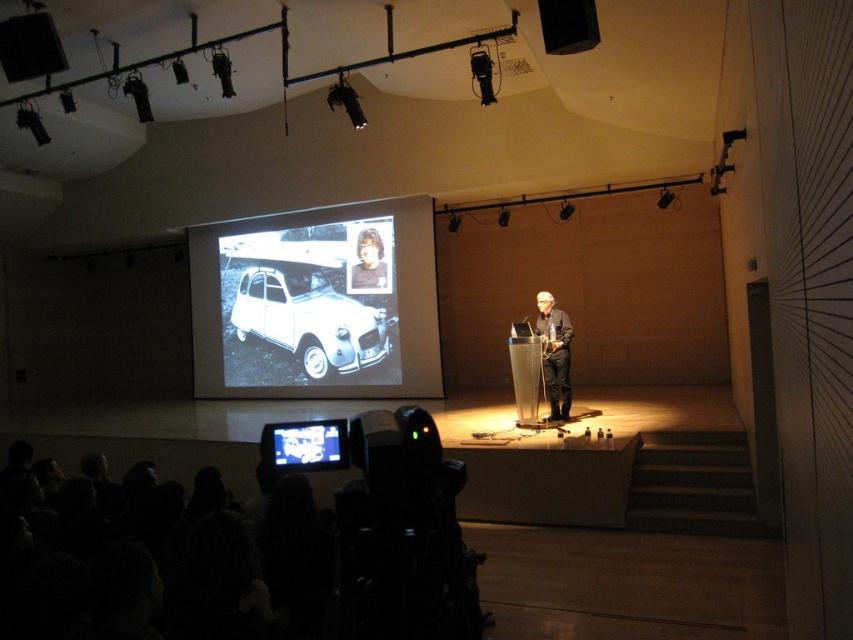
Which is in front, point (392, 259) or point (350, 280)?

Positioned in front is point (392, 259).

Is black matte projection screen at center thinner than smooth skin face at center?

No, black matte projection screen at center is not thinner than smooth skin face at center.

Locate an element on the screen. The image size is (853, 640). black matte projection screen at center is located at coordinates coord(315,305).

Is white matte car at center to the right of black fabric person at center from the viewer's perspective?

No, white matte car at center is not to the right of black fabric person at center.

Is white matte car at center further to the viewer compared to black fabric person at center?

Yes, it is behind black fabric person at center.

Which is in front, point (244, 337) or point (566, 349)?

Point (566, 349) is more forward.

At what (x,y) coordinates should I click in order to perform the action: click on white matte car at center. Please return your answer as a coordinate pair (x, y). The height and width of the screenshot is (640, 853). Looking at the image, I should click on (308, 316).

Between black fabric person at center and black matte speaker at upper right, which one appears on the left side from the viewer's perspective?

From the viewer's perspective, black matte speaker at upper right appears more on the left side.

Can you confirm if black fabric person at center is taller than black matte speaker at upper right?

Correct, black fabric person at center is much taller as black matte speaker at upper right.

The height and width of the screenshot is (640, 853). Identify the location of black fabric person at center. (554, 355).